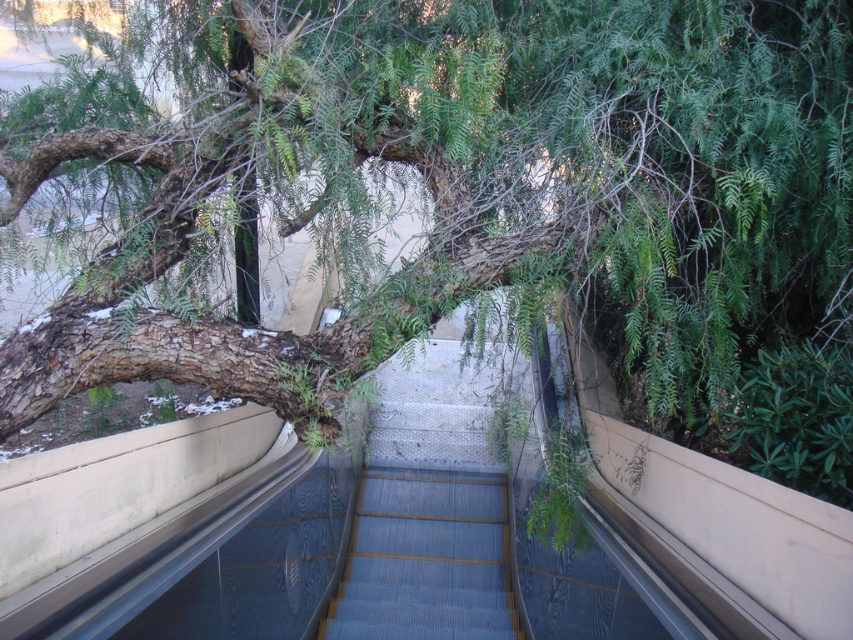
You are standing on the escalator and see a point marked at coordinates (467, 182). Based on the scene, what object or feature does this point most likely represent?

The point at coordinates (467, 182) corresponds to the green leafy tree at upper left.

You are a maintenance worker checking the escalator. You need to ensure there is enough clearance between the green leafy tree at upper left and the smooth blue stairs at center for safe operation. Based on the scene description, is the clearance sufficient?

The green leafy tree at upper left is much taller than the smooth blue stairs at center, so the clearance between them is sufficient for safe operation.